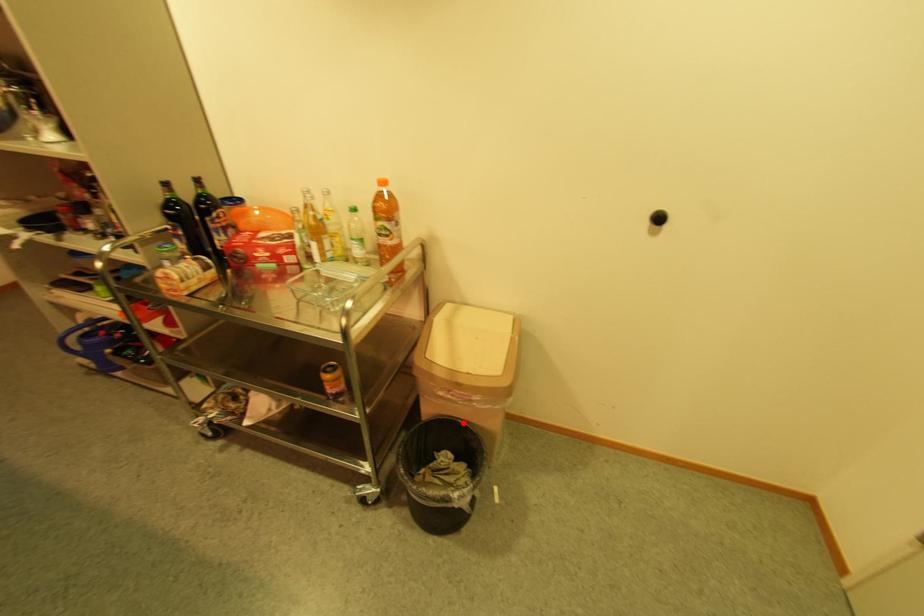
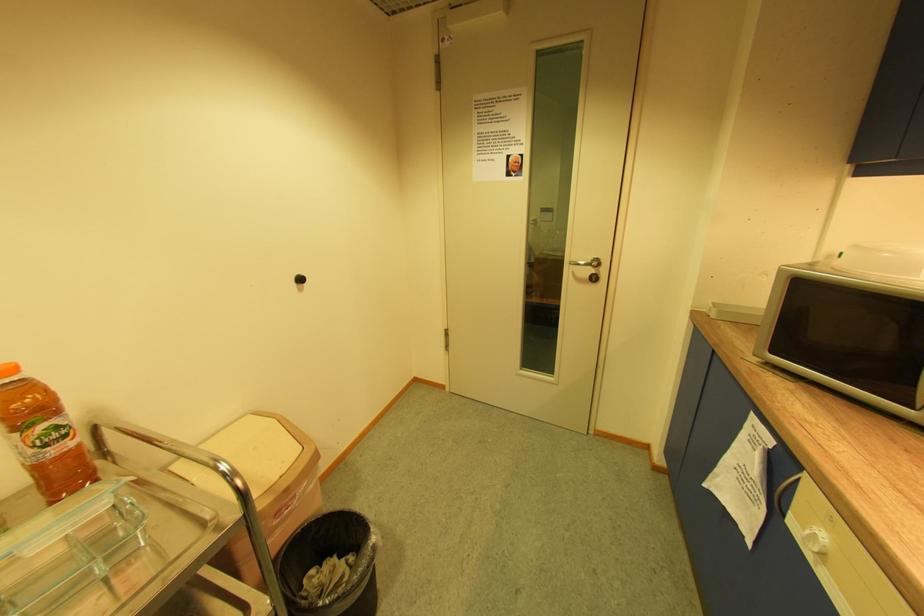
The point at the highlighted location is marked in the first image. Where is the corresponding point in the second image?

(304, 533)